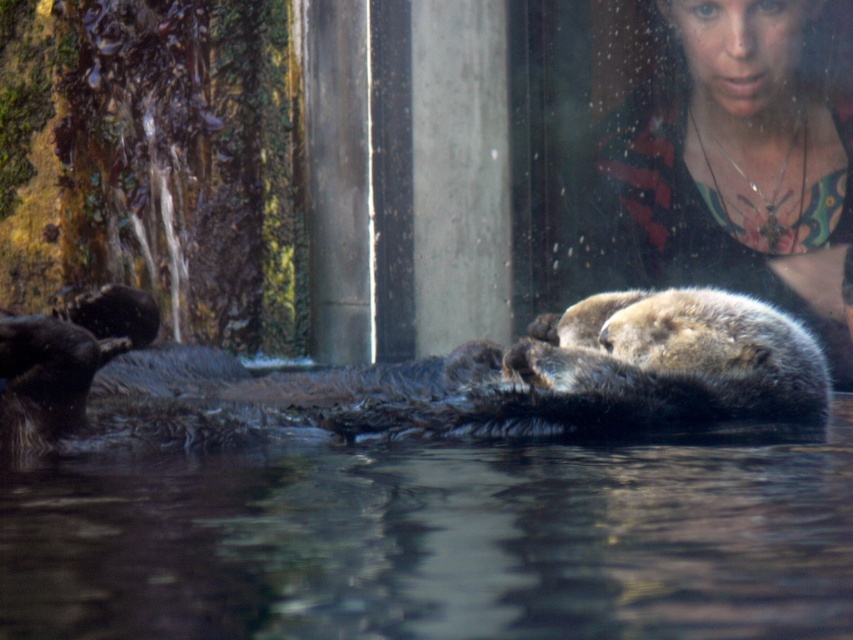
Question: Which of the following is the farthest from the observer?

Choices:
 (A) brown fur otter at center
 (B) transparent water at center

Answer: (A)

Question: Estimate the real-world distances between objects in this image. Which object is farther from the dark brown fur otter at center?

Choices:
 (A) transparent water at center
 (B) smooth black shirt at upper right

Answer: (B)

Question: Observing the image, what is the correct spatial positioning of dark brown fur otter at center in reference to smooth black shirt at upper right?

Choices:
 (A) right
 (B) left

Answer: (B)

Question: Does dark brown fur otter at center have a larger size compared to smooth black shirt at upper right?

Choices:
 (A) yes
 (B) no

Answer: (B)

Question: Which point appears closest to the camera in this image?

Choices:
 (A) (695, 184)
 (B) (86, 547)

Answer: (B)

Question: Can you confirm if dark brown fur otter at center is smaller than brown fur otter at center?

Choices:
 (A) yes
 (B) no

Answer: (B)